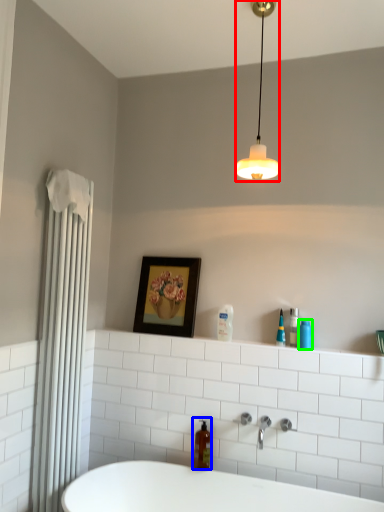
Question: Based on their relative distances, which object is farther from lamp (highlighted by a red box)? Choose from soap dispenser (highlighted by a blue box) and toiletry (highlighted by a green box).

Choices:
 (A) soap dispenser
 (B) toiletry

Answer: (A)